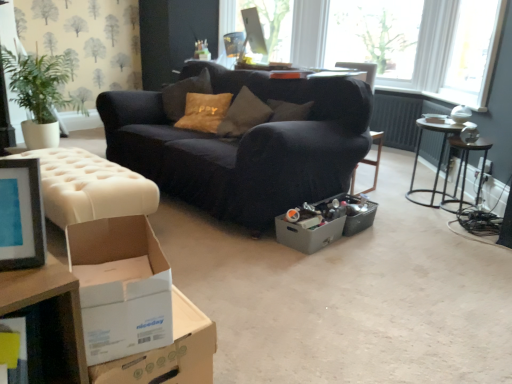
Where is `free spot below metallic silver table at right, marked as the 2th table in a top-to-bottom arrangement (from a real-world perspective)`? free spot below metallic silver table at right, marked as the 2th table in a top-to-bottom arrangement (from a real-world perspective) is located at coordinates (423, 199).